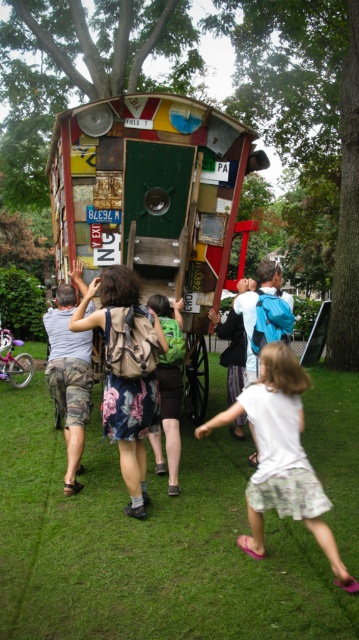
You are standing in the park and see a group of people around the decorated structure. There is a white cotton shirt at lower right and a green backpack at center. Which object is positioned more to the east?

The white cotton shirt at lower right is positioned more to the east because it is to the right of the green backpack at center, and in the scene, right corresponds to east.

You are standing in the park and see a person wearing a white cotton shirt at lower right and a green backpack at center. Which object is higher up in the image?

The white cotton shirt at lower right is above the green backpack at center in the image.